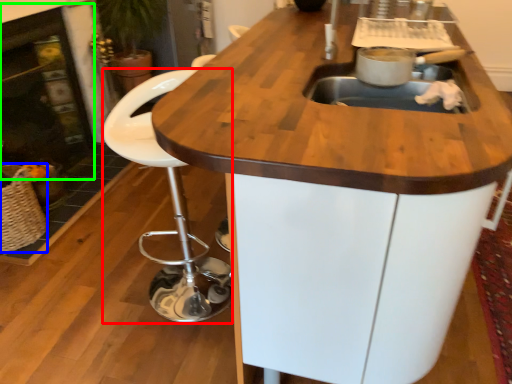
Question: Which object is the farthest from chair (highlighted by a red box)? Choose among these: basket (highlighted by a blue box) or fireplace (highlighted by a green box).

Choices:
 (A) basket
 (B) fireplace

Answer: (B)